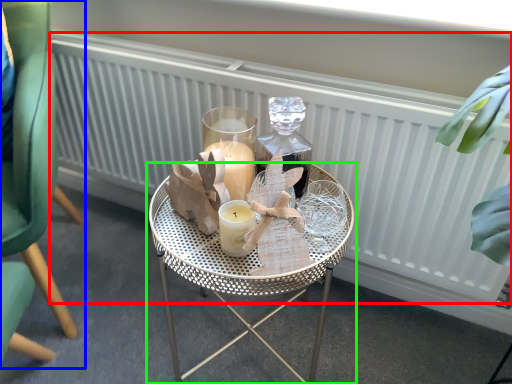
Question: Which object is the closest to the radiator (highlighted by a red box)? Choose among these: chair (highlighted by a blue box) or table (highlighted by a green box).

Choices:
 (A) chair
 (B) table

Answer: (B)